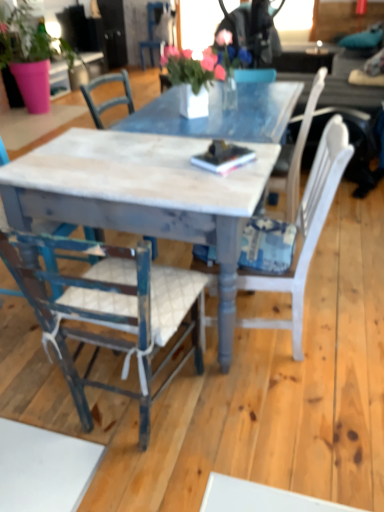
Question: Is white painted wood chair at center, which appears as the 2th chair when viewed from the front, positioned with its back to white painted wood chair at left, which appears as the 2th chair when viewed from the top?

Choices:
 (A) yes
 (B) no

Answer: (B)

Question: Is white painted wood chair at center, the second chair ordered from the bottom, completely or partially outside of white painted wood chair at left, placed as the third chair when sorted from bottom to top?

Choices:
 (A) no
 (B) yes

Answer: (B)

Question: Considering the relative sizes of white painted wood chair at center, the 3th chair in the top-to-bottom sequence, and white painted wood chair at left, placed as the third chair when sorted from bottom to top, in the image provided, is white painted wood chair at center, the 3th chair in the top-to-bottom sequence, bigger than white painted wood chair at left, placed as the third chair when sorted from bottom to top,?

Choices:
 (A) yes
 (B) no

Answer: (A)

Question: Considering the relative sizes of white painted wood chair at center, the second chair ordered from the bottom, and white painted wood chair at left, acting as the third chair starting from the front, in the image provided, is white painted wood chair at center, the second chair ordered from the bottom, smaller than white painted wood chair at left, acting as the third chair starting from the front,?

Choices:
 (A) yes
 (B) no

Answer: (B)

Question: Does white painted wood chair at center, the second chair ordered from the bottom, have a greater width compared to white painted wood chair at left, placed as the third chair when sorted from bottom to top?

Choices:
 (A) no
 (B) yes

Answer: (B)

Question: From a real-world perspective, is white painted wood chair at center, the 3th chair viewed from the back, beneath white painted wood chair at left, acting as the third chair starting from the front?

Choices:
 (A) no
 (B) yes

Answer: (B)

Question: Is pink fabric plant at left wider than white painted wood chair at center, the 3th chair in the top-to-bottom sequence?

Choices:
 (A) yes
 (B) no

Answer: (A)

Question: From the image's perspective, is pink fabric plant at left below white painted wood chair at center, the 3th chair viewed from the back?

Choices:
 (A) yes
 (B) no

Answer: (B)

Question: Would you say pink fabric plant at left is a long distance from white painted wood chair at center, the 3th chair in the top-to-bottom sequence?

Choices:
 (A) yes
 (B) no

Answer: (A)

Question: Could you tell me if pink fabric plant at left is facing white painted wood chair at center, which appears as the 2th chair when viewed from the front?

Choices:
 (A) no
 (B) yes

Answer: (A)

Question: From the image's perspective, is pink fabric plant at left on white painted wood chair at center, the second chair ordered from the bottom?

Choices:
 (A) no
 (B) yes

Answer: (B)

Question: From a real-world perspective, is pink fabric plant at left positioned over white painted wood chair at center, which appears as the 2th chair when viewed from the front, based on gravity?

Choices:
 (A) yes
 (B) no

Answer: (A)

Question: Is distressed wood chair at center, which appears as the 1th chair when viewed from the front, not within pink fabric floral arrangement at center?

Choices:
 (A) yes
 (B) no

Answer: (A)